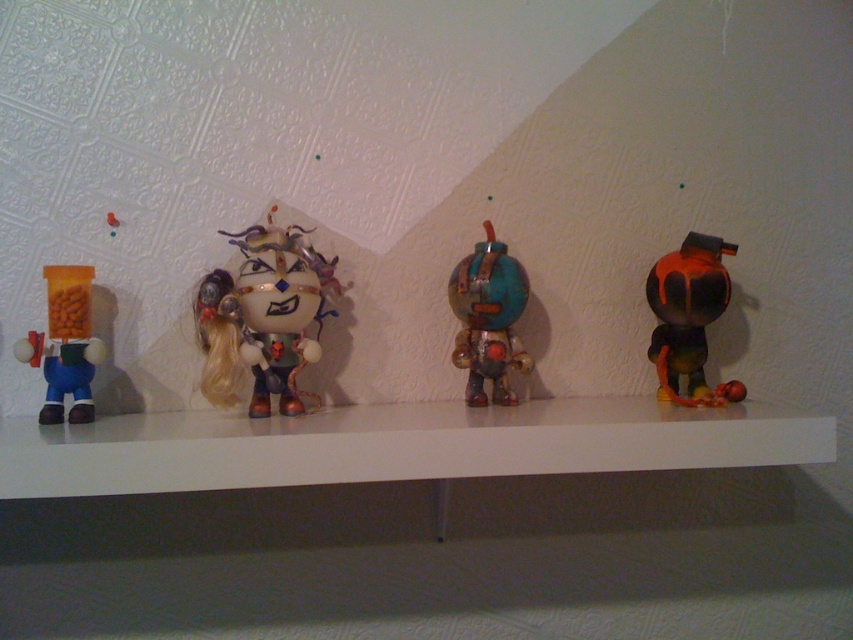
Question: From the image, what is the correct spatial relationship of white glossy mantle at center in relation to matte plastic toy at left?

Choices:
 (A) above
 (B) below

Answer: (B)

Question: Which of the following is the farthest from the observer?

Choices:
 (A) (512, 401)
 (B) (466, 413)

Answer: (A)

Question: Which point appears closest to the camera in this image?

Choices:
 (A) (500, 305)
 (B) (65, 387)
 (C) (178, 488)
 (D) (653, 268)

Answer: (C)

Question: Which point appears closest to the camera in this image?

Choices:
 (A) pos(677,381)
 (B) pos(287,381)
 (C) pos(56,365)
 (D) pos(117,220)

Answer: (C)

Question: Can you confirm if matte white figurine at center is positioned above rusty metallic robot at center?

Choices:
 (A) yes
 (B) no

Answer: (A)

Question: Can you confirm if shiny orange and black robot at right is bigger than matte plastic pill bottle at left?

Choices:
 (A) yes
 (B) no

Answer: (A)